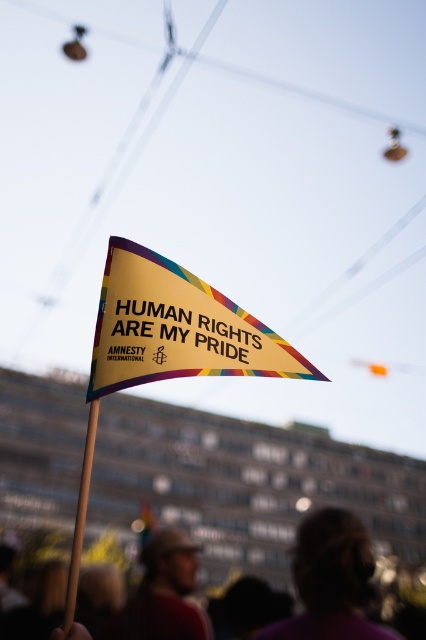
Question: Among these points, which one is nearest to the camera?

Choices:
 (A) (301, 564)
 (B) (89, 426)
 (C) (187, 589)
 (D) (367, 561)

Answer: (B)

Question: Can you confirm if blurred fabric crowd at lower center is positioned above purple fabric hair at lower center?

Choices:
 (A) no
 (B) yes

Answer: (A)

Question: Does gold metallic pennant at center appear over purple fabric hair at lower center?

Choices:
 (A) no
 (B) yes

Answer: (B)

Question: Is gold metallic pennant at center positioned at the back of brown fabric cap at lower center?

Choices:
 (A) yes
 (B) no

Answer: (B)

Question: Which object appears closest to the camera in this image?

Choices:
 (A) blurred fabric crowd at lower center
 (B) wooden stick at center
 (C) purple fabric hair at lower center

Answer: (B)

Question: Considering the real-world distances, which object is closest to the brown fabric cap at lower center?

Choices:
 (A) wooden stick at center
 (B) blurred fabric crowd at lower center

Answer: (B)